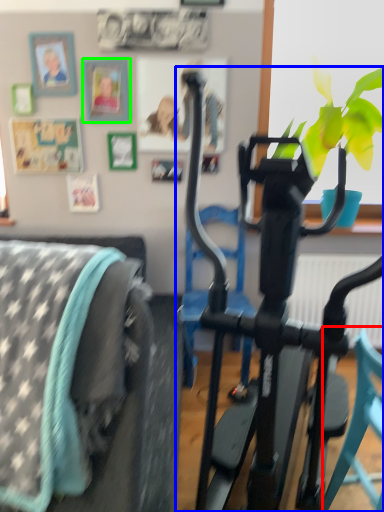
Question: Considering the real-world distances, which object is closest to chair (highlighted by a red box)? stationary bicycle (highlighted by a blue box) or picture frame (highlighted by a green box).

Choices:
 (A) stationary bicycle
 (B) picture frame

Answer: (A)